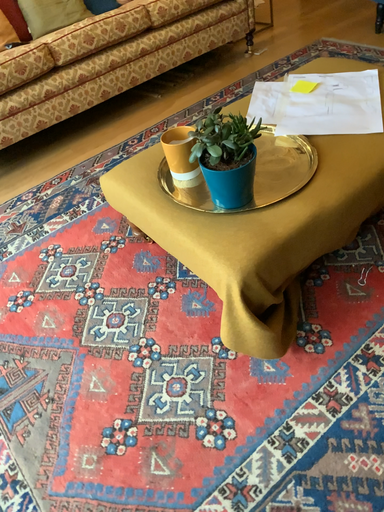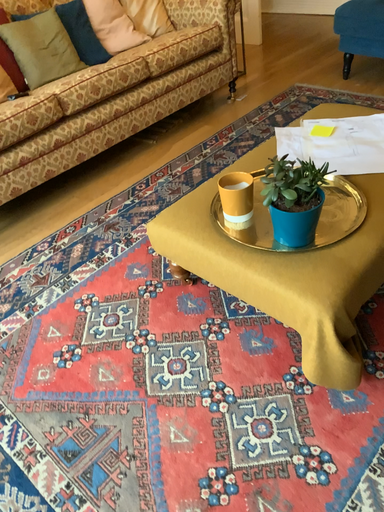
Question: Which way did the camera rotate in the video?

Choices:
 (A) rotated left
 (B) rotated right

Answer: (B)